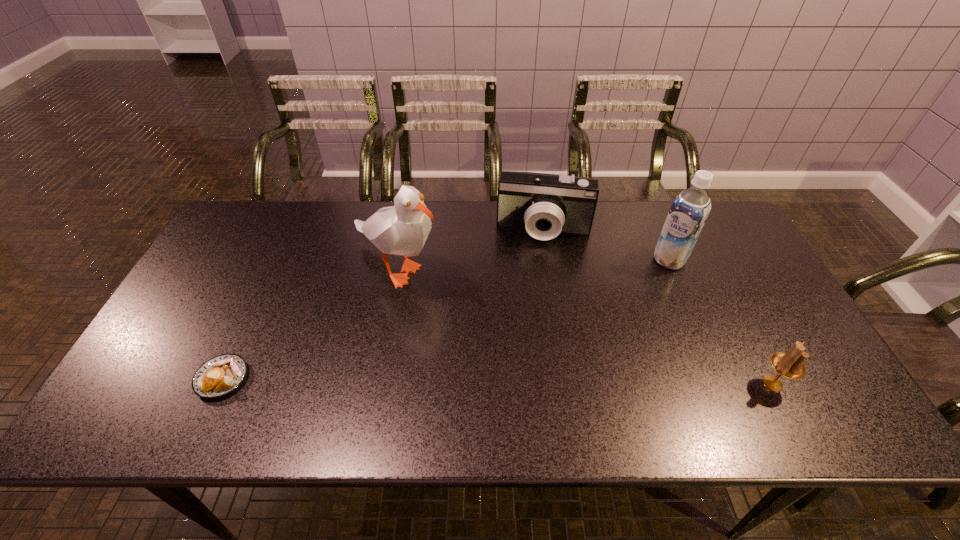
I want to click on pastry, so click(220, 375).

The image size is (960, 540). Find the location of `the shortest object`. the shortest object is located at coordinates (220, 375).

Locate an element on the screen. This screenshot has height=540, width=960. the rightmost object is located at coordinates [x=790, y=365].

The width and height of the screenshot is (960, 540). I want to click on camcorder, so click(x=545, y=205).

This screenshot has height=540, width=960. Identify the location of soya milk. [688, 213].

At what (x,y) coordinates should I click in order to perform the action: click on gull. Please return your answer as a coordinate pair (x, y). Looking at the image, I should click on (402, 229).

Where is `vacant space located on the right of the leftmost object`? vacant space located on the right of the leftmost object is located at coordinates (366, 379).

Where is `vacant region located on the back of the rightmost object`? Image resolution: width=960 pixels, height=540 pixels. vacant region located on the back of the rightmost object is located at coordinates (726, 293).

Where is `free space located on the lens of the camcorder`? Image resolution: width=960 pixels, height=540 pixels. free space located on the lens of the camcorder is located at coordinates (535, 281).

Find the location of `vacant space located 0.260m on the lens of the camcorder`. vacant space located 0.260m on the lens of the camcorder is located at coordinates (532, 310).